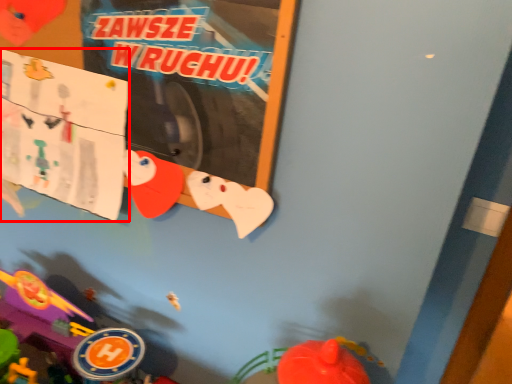
Question: From the image's perspective, what is the correct spatial relationship of poster page (annotated by the red box) in relation to toy?

Choices:
 (A) below
 (B) above

Answer: (B)